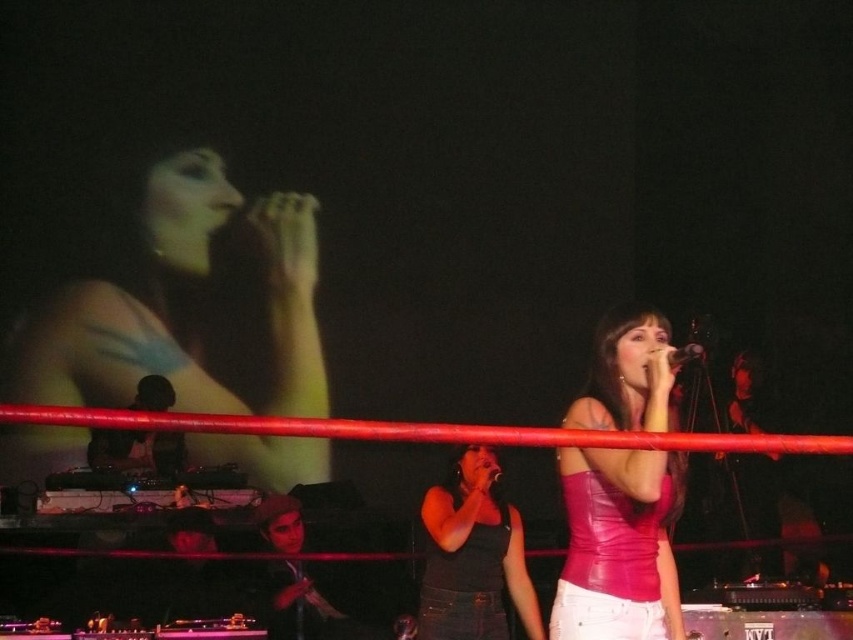
Question: Does pink leather top at center have a larger size compared to matte black tank top at center?

Choices:
 (A) yes
 (B) no

Answer: (A)

Question: Considering the real-world distances, which object is closest to the matte black tank top at center?

Choices:
 (A) metallic silver microphone at upper center
 (B) matte black microphone at upper left

Answer: (A)

Question: Is pink leather top at center wider than metallic silver microphone at upper center?

Choices:
 (A) yes
 (B) no

Answer: (A)

Question: Is matte black microphone at upper left to the left of pink leather top at center from the viewer's perspective?

Choices:
 (A) no
 (B) yes

Answer: (B)

Question: Which point is closer to the camera taking this photo?

Choices:
 (A) (666, 355)
 (B) (519, 554)

Answer: (A)

Question: Which object is closer to the camera taking this photo?

Choices:
 (A) matte black tank top at center
 (B) metallic silver microphone at upper center

Answer: (B)